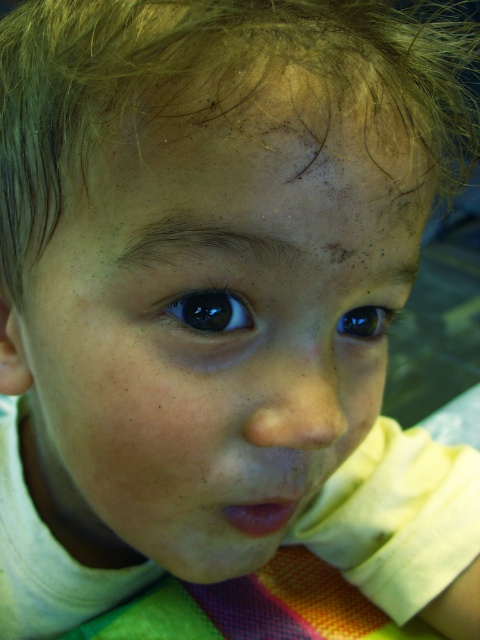
Looking at this image, you are a photographer adjusting the focus on your camera. You notice two eyes in the image, the glossy blue eye at center and the dark blue eye at center. Which eye should you focus on to ensure the closest object is sharp?

The glossy blue eye at center is in front of the dark blue eye at center, so you should focus on the glossy blue eye at center to ensure the closest object is sharp.

You are a photographer adjusting the lighting for a portrait. You notice the blonde fine hair at upper center and the glossy blue eye at center. Which object is closer to the top of the image?

The blonde fine hair at upper center is closer to the top of the image because it is positioned over the glossy blue eye at center.

The child has two eyes, a glossy blue eye at center and a dark blue eye at center. Which one is on the left side?

The glossy blue eye at center is positioned on the left side of dark blue eye at center.